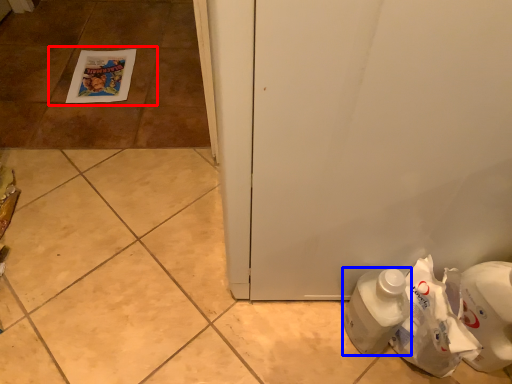
Question: Which point is further to the camera, tile (highlighted by a red box) or bottle (highlighted by a blue box)?

Choices:
 (A) tile
 (B) bottle

Answer: (A)